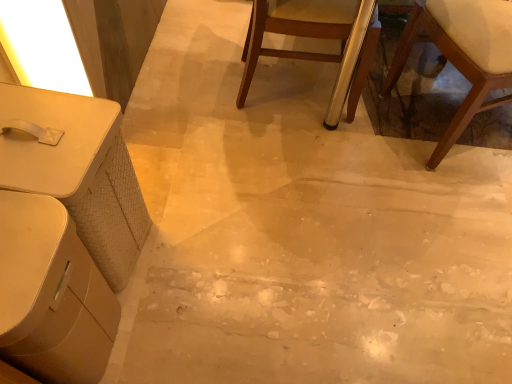
This screenshot has height=384, width=512. I want to click on free space below wooden chair with white cushion at lower right, which is counted as the second chair, starting from the left (from a real-world perspective), so click(465, 129).